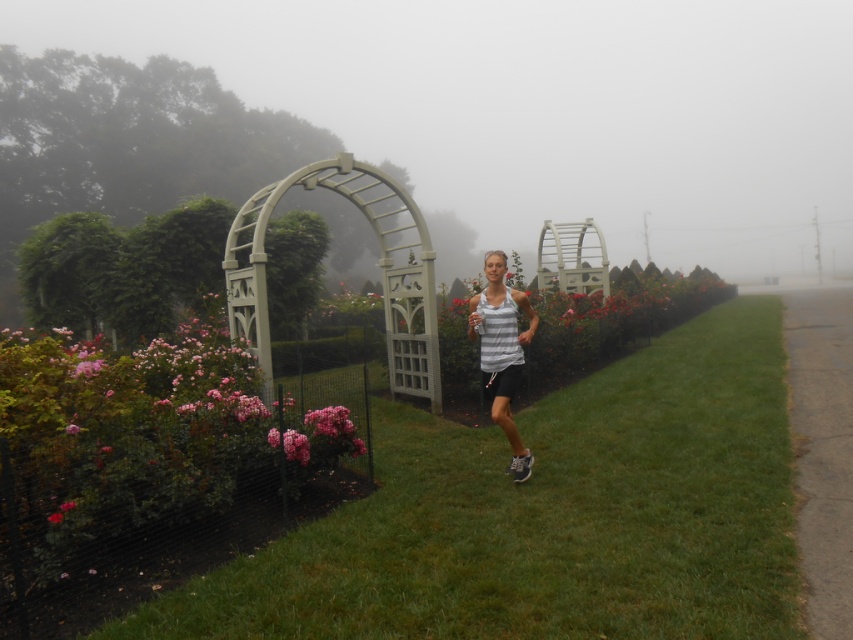
You are a drone operator trying to capture a photo of the jogger in the scene. The green grass at center is located at coordinates point 0.806, 0.644. If you want to focus on the jogger, should you adjust your camera upwards or downwards based on the grass position?

The green grass at center is located at point (548, 515). Since the jogger is in the foreground and the grass is at the center, you should adjust the camera downwards to focus on the jogger.

You are standing on the gray asphalt at lower right and want to get to the green grass at center. Which direction should you move in?

You should move upward because the green grass at center is located below the gray asphalt at lower right.